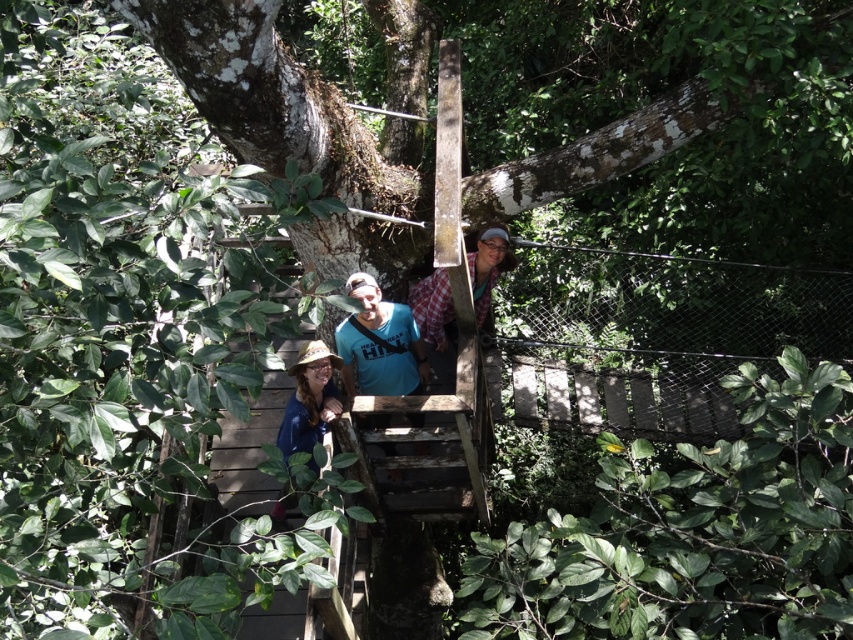
Who is more distant from viewer, (364, 390) or (303, 378)?

Point (364, 390)

Does blue t-shirt at center have a lesser height compared to matte blue shirt at lower left?

Incorrect, blue t-shirt at center's height does not fall short of matte blue shirt at lower left's.

Does point (419, 364) lie behind point (318, 358)?

Yes, it is.

I want to click on blue t-shirt at center, so click(379, 342).